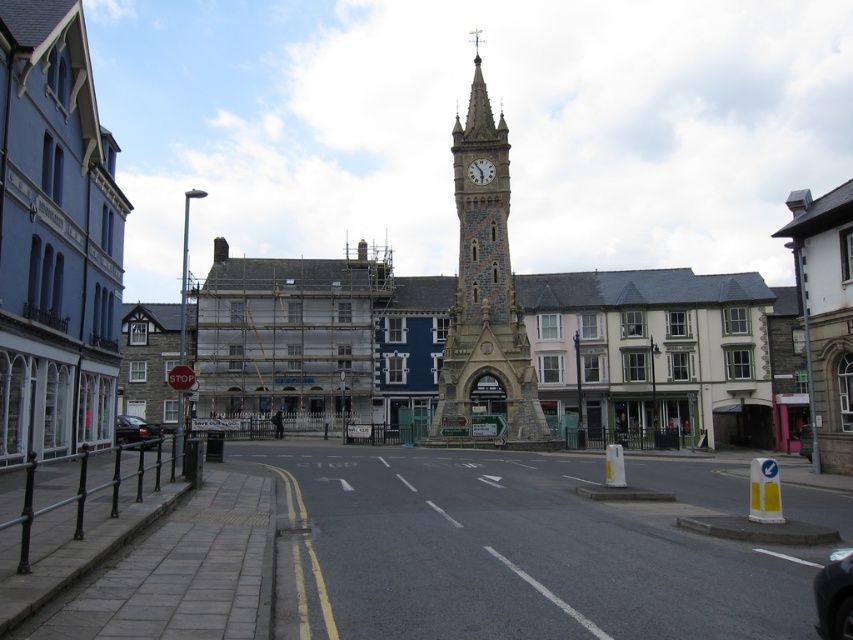
You are an architect visiting the town square and notice both the stone clock tower at center and the white stone clock at center. Which one is larger in size?

The stone clock tower at center is bigger than the white stone clock at center, so the stone clock tower at center is larger in size.